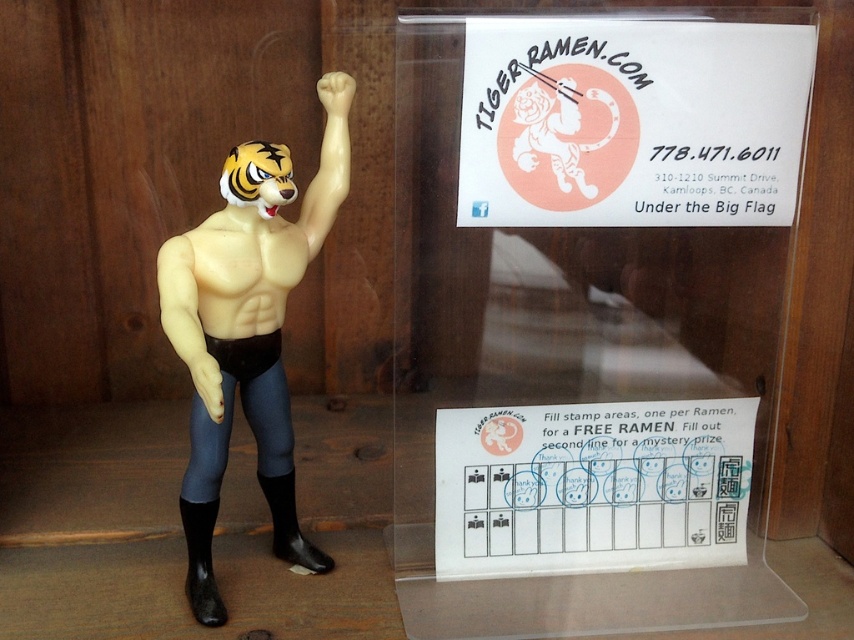
Question: Does white paper sign at upper center lie in front of white paper at upper center?

Choices:
 (A) yes
 (B) no

Answer: (A)

Question: Which object is the closest to the white matte tiger head at upper center?

Choices:
 (A) matte plastic tiger figure at center
 (B) white paper at upper center
 (C) smooth beige muscle at center

Answer: (C)

Question: Can you confirm if white paper sign at upper center is thinner than white matte tiger head at upper center?

Choices:
 (A) no
 (B) yes

Answer: (A)

Question: Which of these objects is positioned farthest from the white matte tiger head at upper center?

Choices:
 (A) white paper at upper center
 (B) matte plastic tiger figure at center
 (C) white paper sign at upper center

Answer: (B)

Question: Among these objects, which one is nearest to the camera?

Choices:
 (A) matte plastic tiger figure at center
 (B) smooth beige muscle at center
 (C) white paper sign at upper center
 (D) white matte tiger head at upper center

Answer: (A)

Question: Considering the relative positions of smooth beige muscle at center and white matte tiger head at upper center in the image provided, where is smooth beige muscle at center located with respect to white matte tiger head at upper center?

Choices:
 (A) right
 (B) left

Answer: (B)